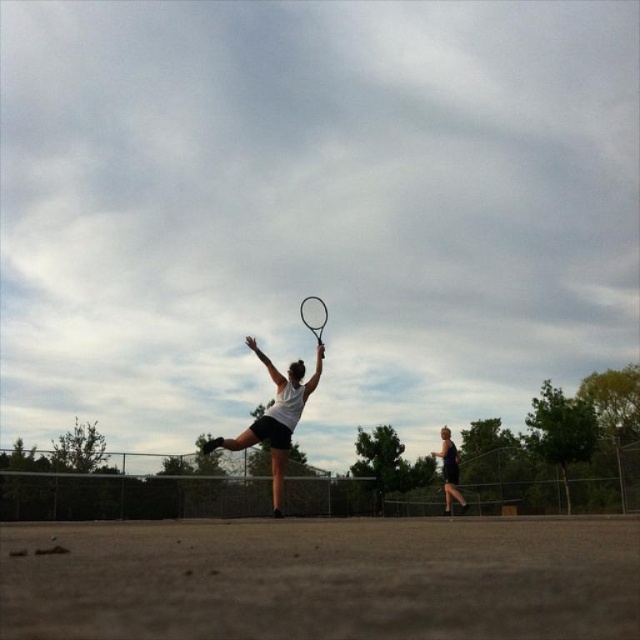
Measure the distance between point [445,486] and camera.

They are 53.63 feet apart.

Where is `purple fabric shorts at right`? The width and height of the screenshot is (640, 640). purple fabric shorts at right is located at coordinates (449, 470).

Measure the distance between white matte tennis racket at center and camera.

A distance of 9.92 meters exists between white matte tennis racket at center and camera.

Is white matte tennis racket at center to the left of purple fabric shorts at right from the viewer's perspective?

Indeed, white matte tennis racket at center is positioned on the left side of purple fabric shorts at right.

Is point (260, 429) positioned in front of point (461, 504)?

Yes, it is.

I want to click on white matte tennis racket at center, so 275,417.

Where is `white matte tennis racket at center`? Image resolution: width=640 pixels, height=640 pixels. white matte tennis racket at center is located at coordinates click(275, 417).

Does white matte tennis racket at center have a lesser height compared to black matte tennis racket at center?

No.

Find the location of a particular element. The height and width of the screenshot is (640, 640). white matte tennis racket at center is located at coordinates (275, 417).

The width and height of the screenshot is (640, 640). Find the location of `white matte tennis racket at center`. white matte tennis racket at center is located at coordinates (275, 417).